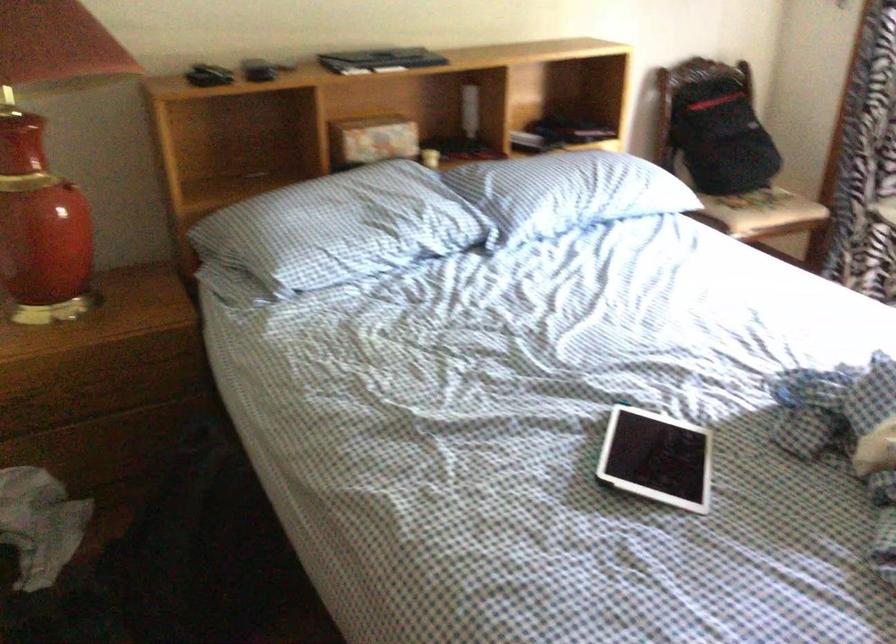
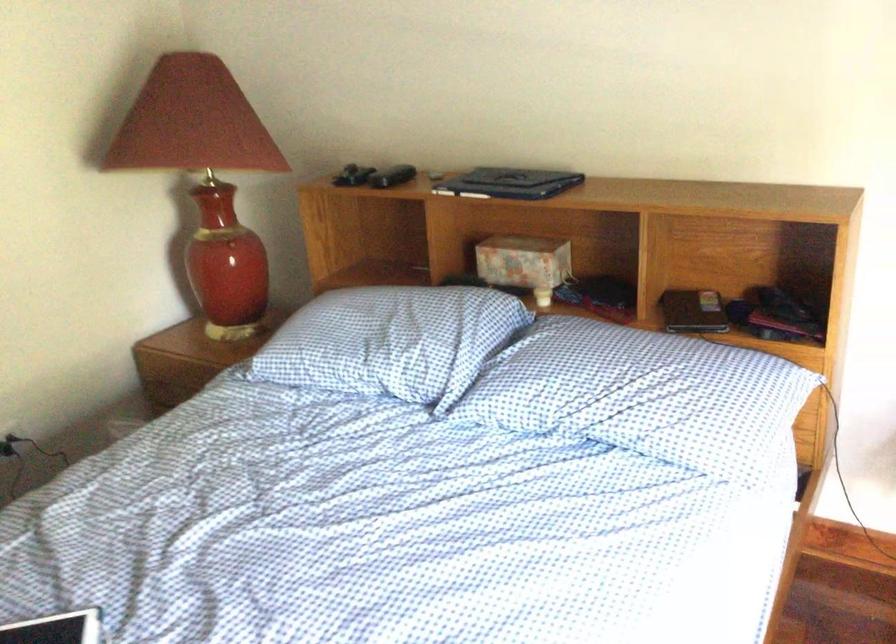
In the second image, find the point that corresponds to (x=618, y=169) in the first image.

(659, 392)